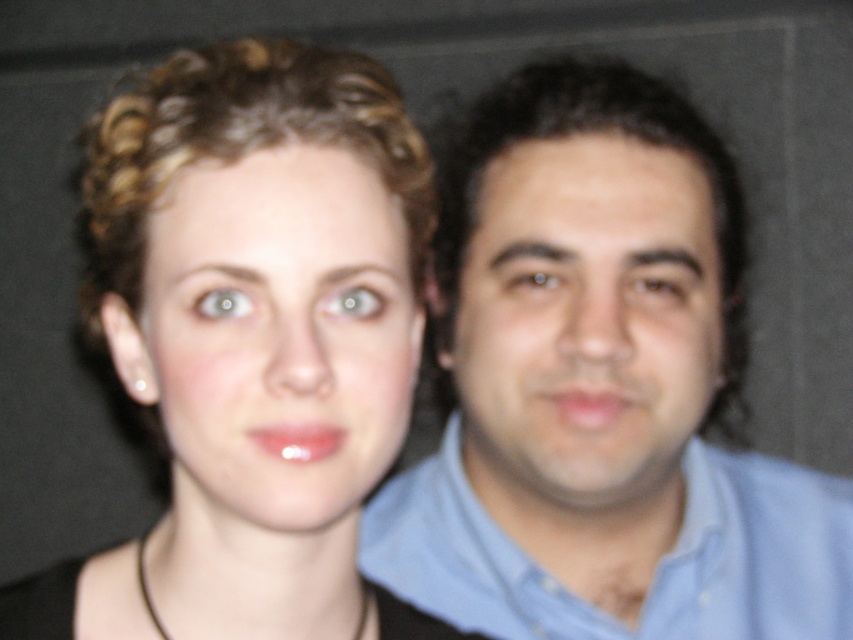
Question: Which point appears closest to the camera in this image?

Choices:
 (A) (630, 301)
 (B) (225, 337)
 (C) (741, 612)
 (D) (544, 141)

Answer: (B)

Question: Which point is closer to the camera taking this photo?

Choices:
 (A) (537, 586)
 (B) (129, 396)
 (C) (635, 317)
 (D) (682, 294)

Answer: (C)

Question: Is blue shirt at right smaller than matte black hair at center?

Choices:
 (A) yes
 (B) no

Answer: (B)

Question: Considering the relative positions of blue shirt at right and matte skin face at center in the image provided, where is blue shirt at right located with respect to matte skin face at center?

Choices:
 (A) left
 (B) right

Answer: (B)

Question: Does matte black hair at center have a greater width compared to blue cotton shirt at right?

Choices:
 (A) yes
 (B) no

Answer: (B)

Question: Which of the following is the closest to the observer?

Choices:
 (A) blue cotton shirt at right
 (B) matte skin face at center
 (C) brown matte eye at center
 (D) smooth skin face at right

Answer: (B)